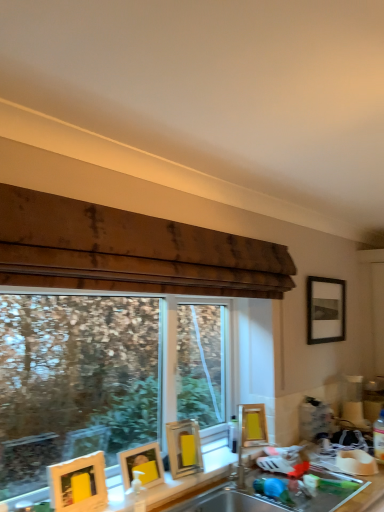
Locate an element on the screen. The width and height of the screenshot is (384, 512). spots to the right of matte gold picture frame at lower left, positioned as the 2th picture frame in front-to-back order is located at coordinates (176, 485).